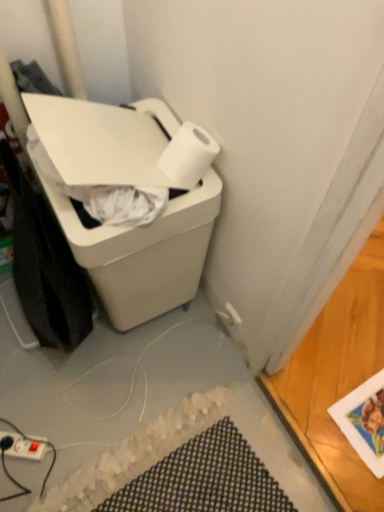
Where is `free region on the left part of black textured bath mat at lower center`? The width and height of the screenshot is (384, 512). free region on the left part of black textured bath mat at lower center is located at coordinates tap(54, 418).